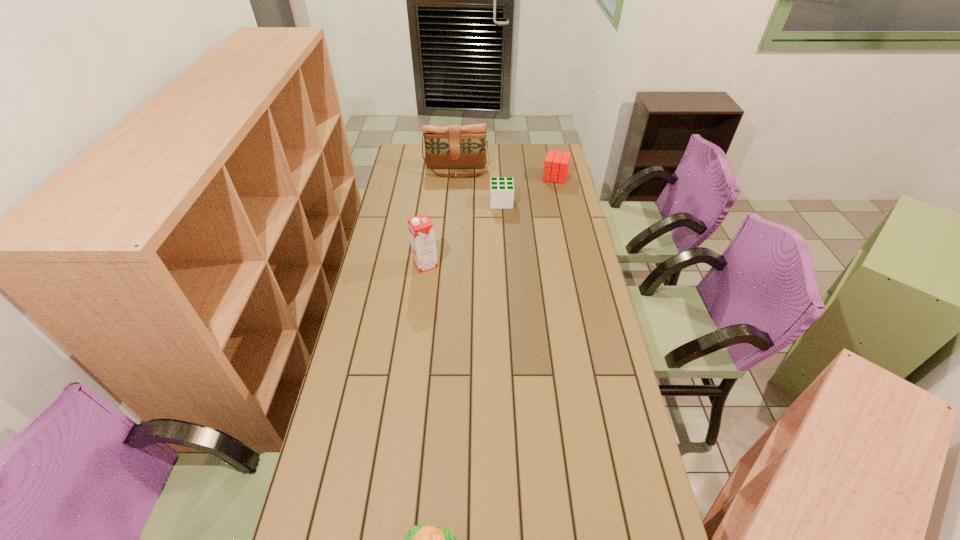
I want to click on shoulder bag, so click(454, 146).

Identify the location of the fourth farthest object. (421, 229).

Locate an element on the screen. The height and width of the screenshot is (540, 960). the right cube is located at coordinates (556, 164).

Locate an element on the screen. the farther cube is located at coordinates (556, 164).

Where is `the nearer cube`? This screenshot has width=960, height=540. the nearer cube is located at coordinates (501, 189).

This screenshot has height=540, width=960. In order to click on the left cube in this screenshot , I will do tap(501, 189).

You are a GUI agent. You are given a task and a screenshot of the screen. Output one action in this format:
    pyautogui.click(x=<x>, y=<y>)
    Task: Click on the vacant space located 0.260m on the front-facing side of the shoulder bag
    This screenshot has width=960, height=540.
    Given the screenshot: What is the action you would take?
    pyautogui.click(x=454, y=210)

The image size is (960, 540). In order to click on vacant space located on the front of the fourth farthest object in this screenshot , I will do `click(420, 310)`.

At what (x,y) coordinates should I click in order to perform the action: click on vacant space located 0.380m on the left of the rightmost object. Please return your answer as a coordinate pair (x, y). The image size is (960, 540). Looking at the image, I should click on (467, 177).

Image resolution: width=960 pixels, height=540 pixels. In order to click on vacant region located on the red face of the left cube in this screenshot , I will do `click(473, 202)`.